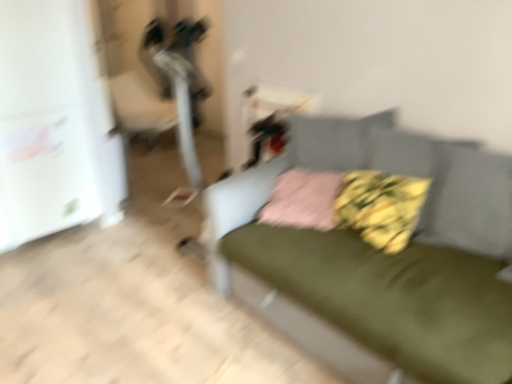
This screenshot has height=384, width=512. What do you see at coordinates (380, 207) in the screenshot? I see `fluffy yellow pillow at center, which is the 2th pillow in left-to-right order` at bounding box center [380, 207].

The image size is (512, 384). What are the coordinates of `green fabric couch at center` in the screenshot? It's located at (381, 258).

Describe the element at coordinates (381, 258) in the screenshot. I see `green fabric couch at center` at that location.

The height and width of the screenshot is (384, 512). What are the coordinates of `fluffy yellow pillow at center, which is the 2th pillow in left-to-right order` in the screenshot? It's located at (380, 207).

Is pink fabric pillow at center, which is the 2th pillow from right to left, smaller than fluffy yellow pillow at center, which is the 2th pillow in left-to-right order?

Yes, pink fabric pillow at center, which is the 2th pillow from right to left, is smaller than fluffy yellow pillow at center, which is the 2th pillow in left-to-right order.

Is pink fabric pillow at center, which is the 2th pillow from right to left, far from fluffy yellow pillow at center, which is the 2th pillow in left-to-right order?

pink fabric pillow at center, which is the 2th pillow from right to left, is actually quite close to fluffy yellow pillow at center, which is the 2th pillow in left-to-right order.

How distant is pink fabric pillow at center, which is the 2th pillow from right to left, from fluffy yellow pillow at center, which is the 2th pillow in left-to-right order?

pink fabric pillow at center, which is the 2th pillow from right to left, is 8.78 inches from fluffy yellow pillow at center, which is the 2th pillow in left-to-right order.

From the image's perspective, between pink fabric pillow at center, acting as the first pillow starting from the left, and fluffy yellow pillow at center, which is the first pillow in right-to-left order, which one is located above?

pink fabric pillow at center, acting as the first pillow starting from the left, is shown above in the image.

Considering the sizes of objects fluffy yellow pillow at center, which is the 2th pillow in left-to-right order, and green fabric couch at center in the image provided, who is smaller, fluffy yellow pillow at center, which is the 2th pillow in left-to-right order, or green fabric couch at center?

fluffy yellow pillow at center, which is the 2th pillow in left-to-right order.

Would you consider fluffy yellow pillow at center, which is the first pillow in right-to-left order, to be distant from green fabric couch at center?

No.

From a real-world perspective, who is located higher, fluffy yellow pillow at center, which is the 2th pillow in left-to-right order, or green fabric couch at center?

In real-world perspective, fluffy yellow pillow at center, which is the 2th pillow in left-to-right order, is above.

Which of these two, fluffy yellow pillow at center, which is the first pillow in right-to-left order, or green fabric couch at center, stands shorter?

With less height is fluffy yellow pillow at center, which is the first pillow in right-to-left order.

Measure the distance between fluffy yellow pillow at center, which is the 2th pillow in left-to-right order, and pink fabric pillow at center, which is the 2th pillow from right to left.

fluffy yellow pillow at center, which is the 2th pillow in left-to-right order, and pink fabric pillow at center, which is the 2th pillow from right to left, are 8.78 inches apart.

Does fluffy yellow pillow at center, which is the first pillow in right-to-left order, have a smaller size compared to pink fabric pillow at center, acting as the first pillow starting from the left?

Incorrect, fluffy yellow pillow at center, which is the first pillow in right-to-left order, is not smaller in size than pink fabric pillow at center, acting as the first pillow starting from the left.

From a real-world perspective, is fluffy yellow pillow at center, which is the first pillow in right-to-left order, beneath pink fabric pillow at center, acting as the first pillow starting from the left?

No, from a real-world perspective, fluffy yellow pillow at center, which is the first pillow in right-to-left order, is not beneath pink fabric pillow at center, acting as the first pillow starting from the left.

Locate an element on the screen. The image size is (512, 384). pillow in front of the pink fabric pillow at center, acting as the first pillow starting from the left is located at coordinates (380, 207).

How far apart are pink fabric pillow at center, acting as the first pillow starting from the left, and green fabric couch at center?

34.10 centimeters.

From a real-world perspective, is pink fabric pillow at center, which is the 2th pillow from right to left, located higher than green fabric couch at center?

Yes, from a real-world perspective, pink fabric pillow at center, which is the 2th pillow from right to left, is over green fabric couch at center

Can you confirm if pink fabric pillow at center, acting as the first pillow starting from the left, is thinner than green fabric couch at center?

Yes.

Looking at this image, between pink fabric pillow at center, which is the 2th pillow from right to left, and green fabric couch at center, which one appears on the left side from the viewer's perspective?

pink fabric pillow at center, which is the 2th pillow from right to left, is more to the left.

Is point (420, 260) farther from camera compared to point (285, 199)?

No, (420, 260) is closer to viewer.

Based on the photo, considering the sizes of objects green fabric couch at center and pink fabric pillow at center, which is the 2th pillow from right to left, in the image provided, who is shorter, green fabric couch at center or pink fabric pillow at center, which is the 2th pillow from right to left,?

pink fabric pillow at center, which is the 2th pillow from right to left, is shorter.

Is green fabric couch at center touching pink fabric pillow at center, acting as the first pillow starting from the left?

No, green fabric couch at center is not touching pink fabric pillow at center, acting as the first pillow starting from the left.

Which of these two, green fabric couch at center or fluffy yellow pillow at center, which is the first pillow in right-to-left order, stands taller?

Standing taller between the two is green fabric couch at center.

The width and height of the screenshot is (512, 384). I want to click on studio couch that appears in front of the fluffy yellow pillow at center, which is the first pillow in right-to-left order, so click(381, 258).

Which is in front, point (233, 226) or point (412, 200)?

Positioned in front is point (412, 200).

At what (x,y) coordinates should I click in order to perform the action: click on pillow located on the left of fluffy yellow pillow at center, which is the 2th pillow in left-to-right order. Please return your answer as a coordinate pair (x, y). This screenshot has width=512, height=384. Looking at the image, I should click on (303, 200).

Image resolution: width=512 pixels, height=384 pixels. I want to click on pillow located on the right of green fabric couch at center, so click(x=380, y=207).

Estimate the real-world distances between objects in this image. Which object is closer to green fabric couch at center, pink fabric pillow at center, which is the 2th pillow from right to left, or fluffy yellow pillow at center, which is the 2th pillow in left-to-right order?

The object closer to green fabric couch at center is fluffy yellow pillow at center, which is the 2th pillow in left-to-right order.

Estimate the real-world distances between objects in this image. Which object is further from pink fabric pillow at center, acting as the first pillow starting from the left, green fabric couch at center or fluffy yellow pillow at center, which is the 2th pillow in left-to-right order?

green fabric couch at center.

Looking at the image, which one is located closer to pink fabric pillow at center, acting as the first pillow starting from the left, fluffy yellow pillow at center, which is the 2th pillow in left-to-right order, or green fabric couch at center?

fluffy yellow pillow at center, which is the 2th pillow in left-to-right order, is closer to pink fabric pillow at center, acting as the first pillow starting from the left.

Looking at the image, which one is located closer to green fabric couch at center, fluffy yellow pillow at center, which is the first pillow in right-to-left order, or pink fabric pillow at center, acting as the first pillow starting from the left?

Based on the image, fluffy yellow pillow at center, which is the first pillow in right-to-left order, appears to be nearer to green fabric couch at center.

Which object lies nearer to the anchor point fluffy yellow pillow at center, which is the first pillow in right-to-left order, pink fabric pillow at center, which is the 2th pillow from right to left, or green fabric couch at center?

pink fabric pillow at center, which is the 2th pillow from right to left.

Considering their positions, is green fabric couch at center positioned further to fluffy yellow pillow at center, which is the first pillow in right-to-left order, than pink fabric pillow at center, which is the 2th pillow from right to left?

green fabric couch at center.

The image size is (512, 384). In order to click on pillow between green fabric couch at center and pink fabric pillow at center, acting as the first pillow starting from the left, along the z-axis in this screenshot , I will do tap(380, 207).